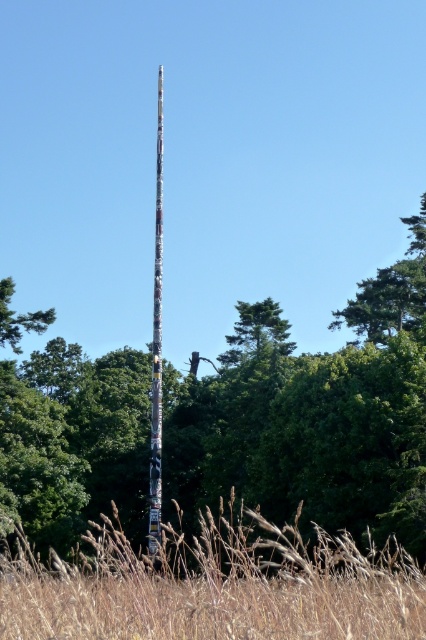
Question: Where is carved wooden totem pole at center located in relation to green textured tree at center in the image?

Choices:
 (A) right
 (B) left

Answer: (B)

Question: Does carved wooden totem pole at center appear over brown dry grass at center?

Choices:
 (A) yes
 (B) no

Answer: (A)

Question: Which object is farther from the camera taking this photo?

Choices:
 (A) carved wooden totem pole at center
 (B) green textured tree at center
 (C) brown dry grass at center
 (D) smooth gray pole at center

Answer: (B)

Question: Which object is the closest to the brown dry grass at center?

Choices:
 (A) green textured tree at center
 (B) smooth gray pole at center

Answer: (B)

Question: Does carved wooden totem pole at center appear on the left side of smooth gray pole at center?

Choices:
 (A) no
 (B) yes

Answer: (A)

Question: Which object appears closest to the camera in this image?

Choices:
 (A) smooth gray pole at center
 (B) carved wooden totem pole at center
 (C) green textured tree at center

Answer: (B)